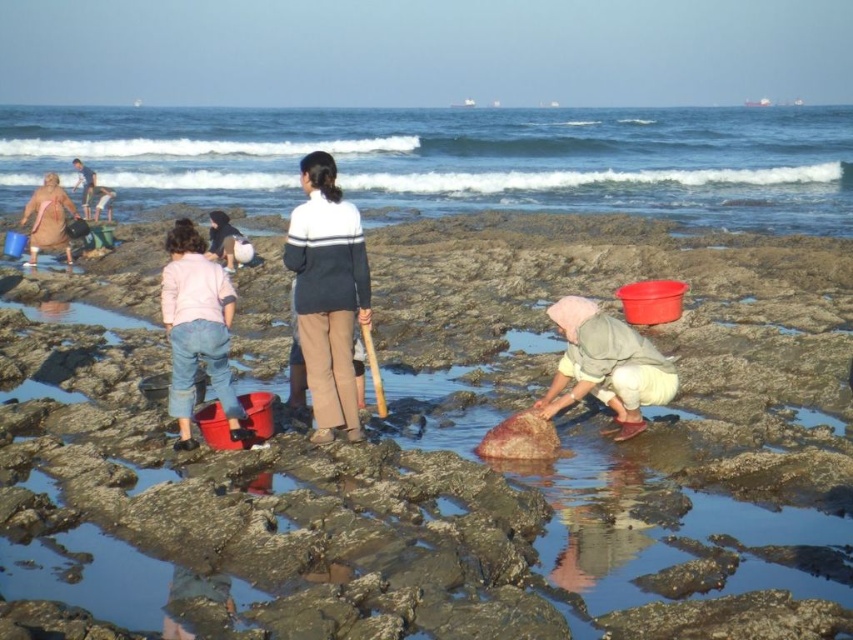
Question: Is clear blue water at upper center smaller than matte pink towel at left?

Choices:
 (A) no
 (B) yes

Answer: (A)

Question: Is clear blue water at upper center above matte pink towel at left?

Choices:
 (A) no
 (B) yes

Answer: (B)

Question: Which of the following is the farthest from the observer?

Choices:
 (A) (45, 246)
 (B) (49, 136)

Answer: (B)

Question: Which point is farther to the camera?

Choices:
 (A) matte pink towel at left
 (B) clear blue water at upper center

Answer: (B)

Question: Among these points, which one is farthest from the camera?

Choices:
 (A) (50, 193)
 (B) (843, 170)

Answer: (B)

Question: Is clear blue water at upper center to the right of matte pink towel at left from the viewer's perspective?

Choices:
 (A) no
 (B) yes

Answer: (B)